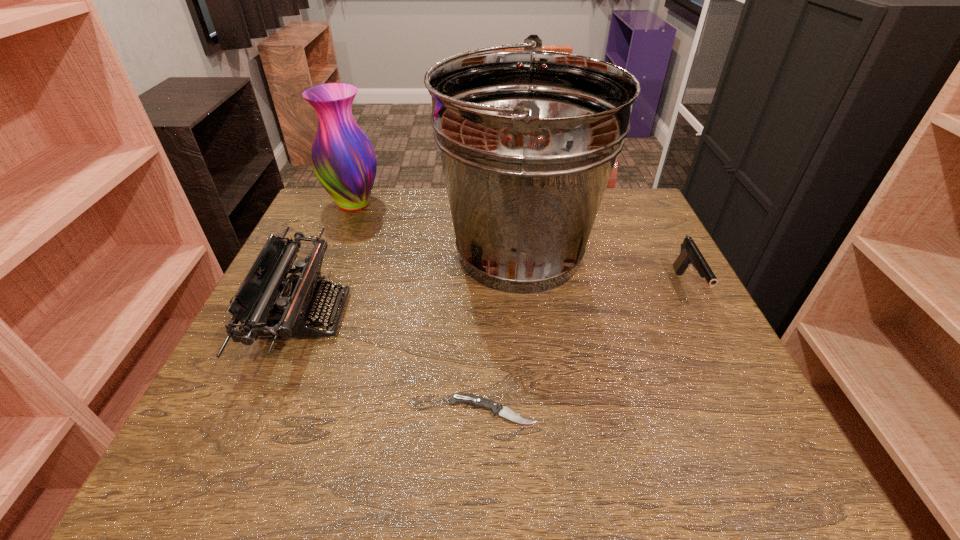
This screenshot has width=960, height=540. I want to click on vacant space that satisfies the following two spatial constraints: 1. at the muzzle of the second shortest object; 2. on the typing side of the third tallest object, so click(702, 315).

Find the location of `vacant region that satisfies the following two spatial constraints: 1. at the muzzle of the second shortest object; 2. on the typing side of the typewriter`. vacant region that satisfies the following two spatial constraints: 1. at the muzzle of the second shortest object; 2. on the typing side of the typewriter is located at coordinates (702, 315).

You are a GUI agent. You are given a task and a screenshot of the screen. Output one action in this format:
    pyautogui.click(x=<x>, y=<y>)
    Task: Click on the free space that satisfies the following two spatial constraints: 1. on the typing side of the shortest object; 2. on the right side of the third tallest object
    The image size is (960, 540).
    Given the screenshot: What is the action you would take?
    pyautogui.click(x=266, y=411)